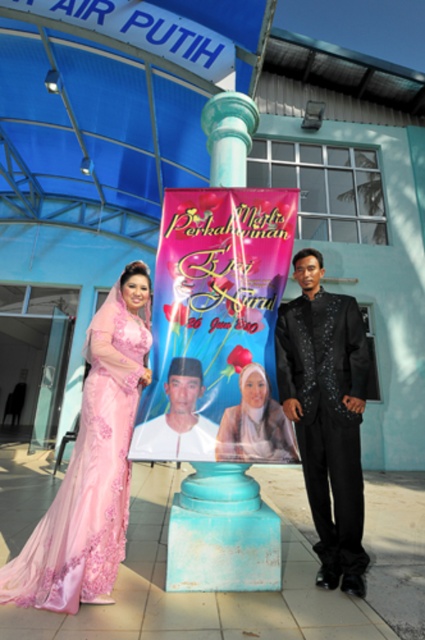
Question: Can you confirm if pink satin banner at center is thinner than pink satin dress at left?

Choices:
 (A) yes
 (B) no

Answer: (B)

Question: Considering the real-world distances, which object is farthest from the matte pink hijab at center?

Choices:
 (A) matte white shirt at center
 (B) pink satin banner at center
 (C) black satin suit at center

Answer: (C)

Question: Is the position of pink satin banner at center less distant than that of black satin suit at center?

Choices:
 (A) yes
 (B) no

Answer: (A)

Question: Estimate the real-world distances between objects in this image. Which object is farther from the pink satin banner at center?

Choices:
 (A) matte pink hijab at center
 (B) pink satin dress at left
 (C) matte white shirt at center

Answer: (B)

Question: Which point is farther to the camera?

Choices:
 (A) click(x=252, y=372)
 (B) click(x=169, y=369)

Answer: (B)

Question: Is pink satin dress at left bigger than matte pink hijab at center?

Choices:
 (A) no
 (B) yes

Answer: (B)